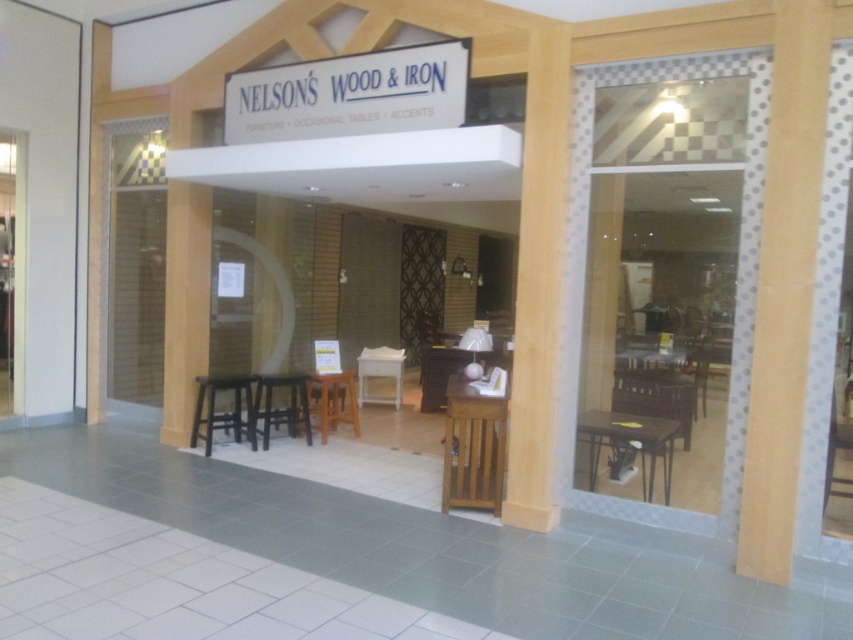
Question: Among these points, which one is farthest from the camera?

Choices:
 (A) (614, 474)
 (B) (537, 310)

Answer: (A)

Question: Does clear glass door at center have a larger size compared to wooden table at center?

Choices:
 (A) yes
 (B) no

Answer: (A)

Question: Which point appears farthest from the camera in this image?

Choices:
 (A) (326, 429)
 (B) (212, 429)
 (C) (664, 401)
 (D) (308, 442)

Answer: (A)

Question: Is matte brown table at right to the left of brown woven chair at center from the viewer's perspective?

Choices:
 (A) no
 (B) yes

Answer: (B)

Question: Where is wooden at right located in relation to black matte stool at lower left in the image?

Choices:
 (A) right
 (B) left

Answer: (A)

Question: Which object is farther from the camera taking this photo?

Choices:
 (A) white wood table at center
 (B) brown woven chair at center

Answer: (A)